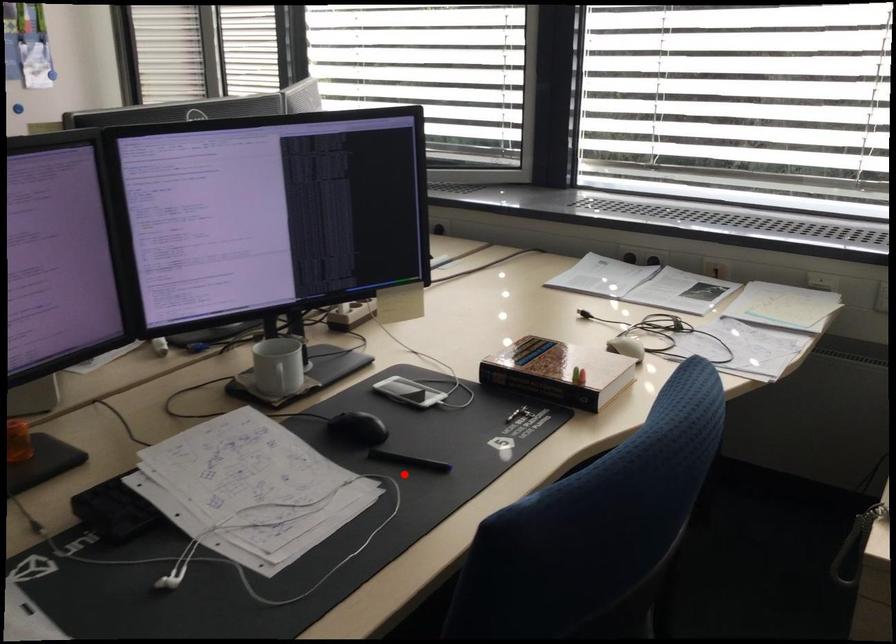
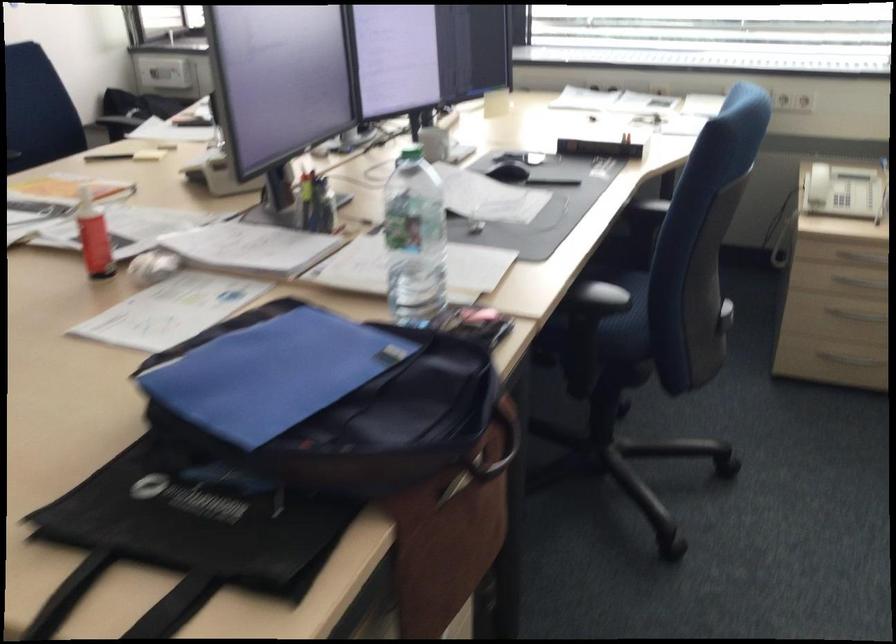
Question: I am providing you with two images of the same scene from different viewpoints. Image1 has a red point marked. In image2, the corresponding 3D location appears at what relative position? Reply with the corresponding letter.

Choices:
 (A) Closer
 (B) Farther

Answer: (B)